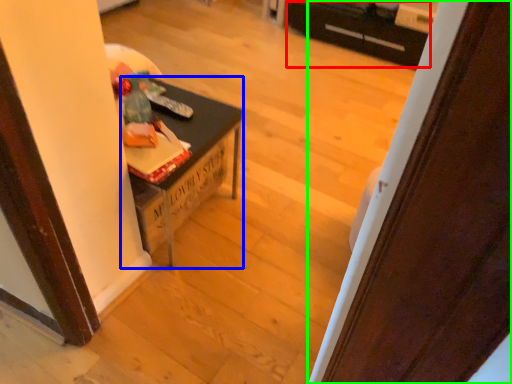
Question: Which object is positioned closest to drawer (highlighted by a red box)? Select from table (highlighted by a blue box) and door (highlighted by a green box).

Choices:
 (A) table
 (B) door

Answer: (A)